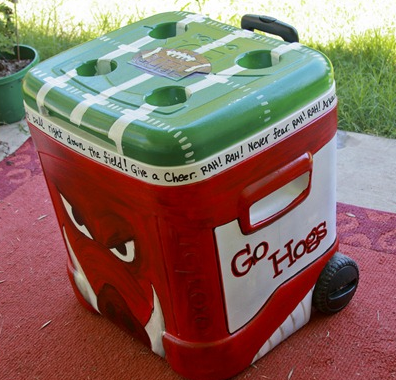
You are a GUI agent. You are given a task and a screenshot of the screen. Output one action in this format:
    pyautogui.click(x=<x>, y=<y>)
    Task: Click on the football painting
    Image resolution: width=396 pixels, height=380 pixels.
    Given the screenshot: What is the action you would take?
    pyautogui.click(x=184, y=48)